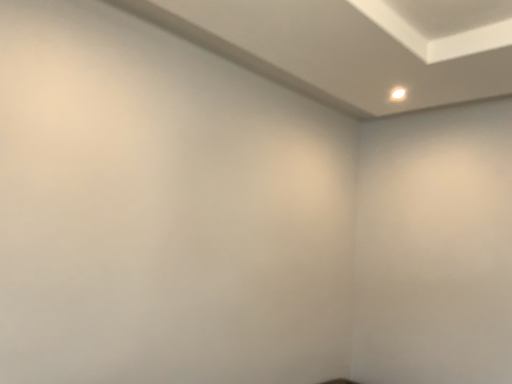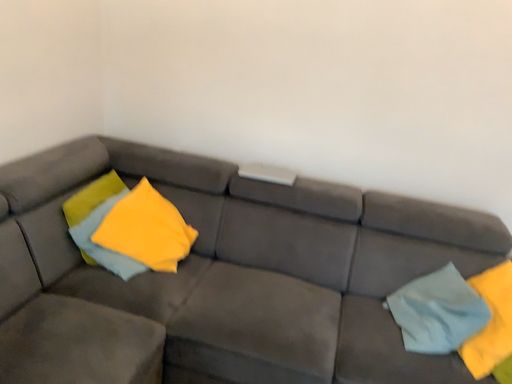
Question: Which way did the camera rotate in the video?

Choices:
 (A) rotated downward
 (B) rotated upward

Answer: (A)